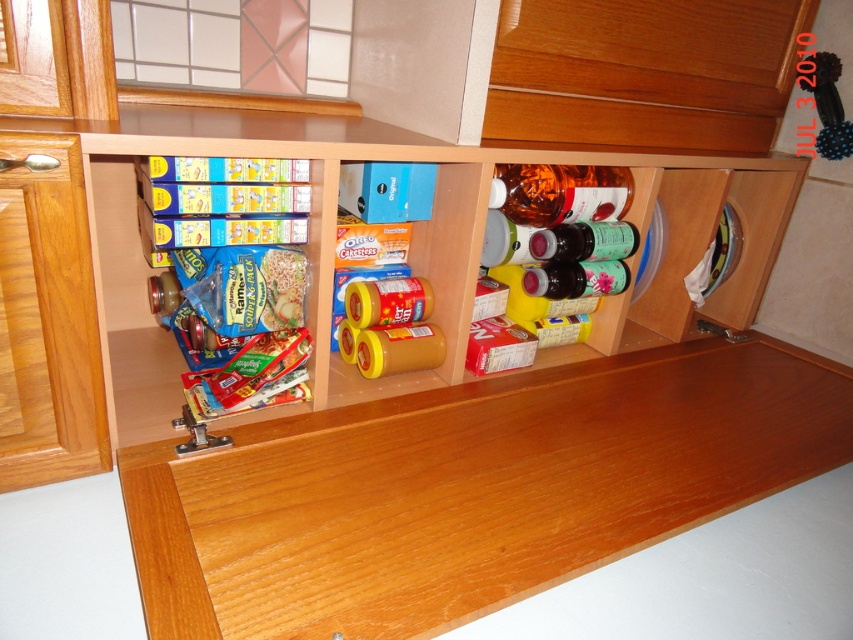
Question: Can you confirm if wooden at center is bigger than metallic hinge at lower left?

Choices:
 (A) yes
 (B) no

Answer: (A)

Question: Which is nearer to the wooden cabinet at center?

Choices:
 (A) wooden drawer at lower left
 (B) wooden at center
 (C) metallic hinge at lower left

Answer: (B)

Question: Which object is closer to the camera taking this photo?

Choices:
 (A) metallic hinge at lower left
 (B) wooden at center

Answer: (B)

Question: Among these points, which one is nearest to the camera?

Choices:
 (A) (660, 273)
 (B) (172, 506)
 (C) (200, 428)
 (D) (59, 259)

Answer: (B)

Question: Does wooden cabinet at center appear on the right side of metallic hinge at lower left?

Choices:
 (A) no
 (B) yes

Answer: (B)

Question: In this image, where is wooden cabinet at center located relative to wooden drawer at lower left?

Choices:
 (A) above
 (B) below

Answer: (A)